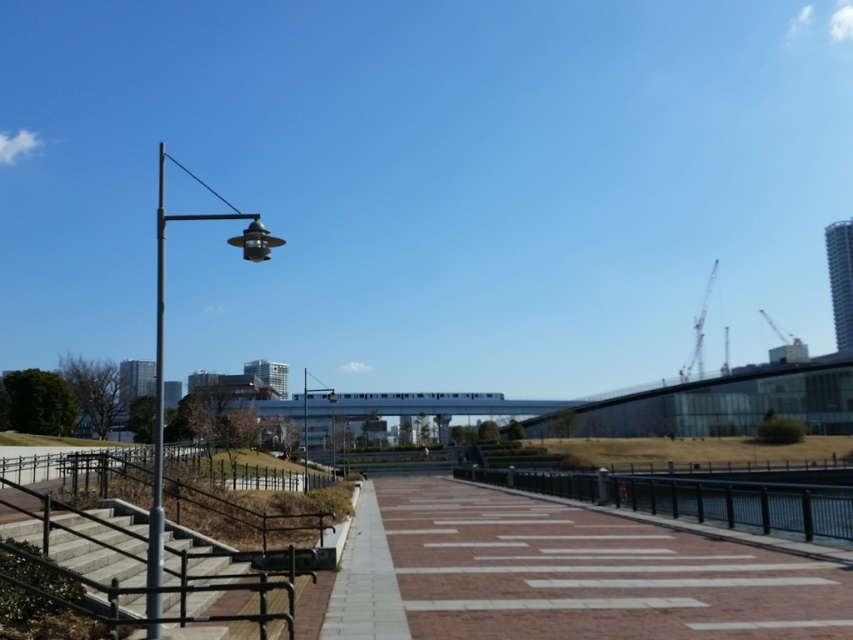
Is black metal rail at center taller than metallic gray pole at left?

No.

Does black metal rail at center have a lesser width compared to metallic gray pole at left?

Indeed, black metal rail at center has a lesser width compared to metallic gray pole at left.

Is point (654, 481) less distant than point (158, 432)?

No.

Image resolution: width=853 pixels, height=640 pixels. I want to click on black metal rail at center, so click(695, 504).

Based on the photo, can you confirm if concrete stairs at lower left is positioned to the right of metallic gray pole at left?

Yes, concrete stairs at lower left is to the right of metallic gray pole at left.

Which is above, concrete stairs at lower left or metallic gray pole at left?

Positioned higher is metallic gray pole at left.

Between point (64, 552) and point (160, 456), which one is positioned behind?

The point (64, 552) is behind.

Find the location of a particular element. The image size is (853, 640). concrete stairs at lower left is located at coordinates (94, 560).

Does black metal rail at center have a lesser width compared to metallic gray streetlight at left?

Yes.

Does black metal rail at center have a greater height compared to metallic gray streetlight at left?

No.

Is point (697, 499) positioned before point (155, 579)?

That is False.

I want to click on black metal rail at center, so click(695, 504).